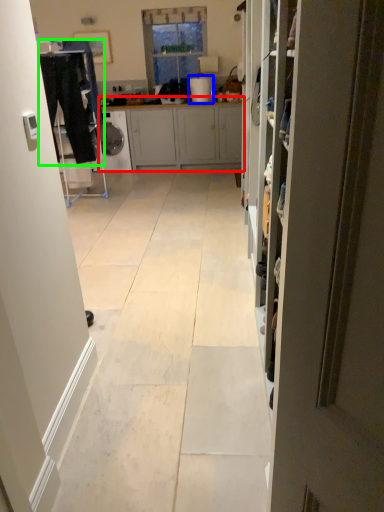
Question: Based on their relative distances, which object is farther from cabinetry (highlighted by a red box)? Choose from appliance (highlighted by a blue box) and laundry (highlighted by a green box).

Choices:
 (A) appliance
 (B) laundry

Answer: (B)